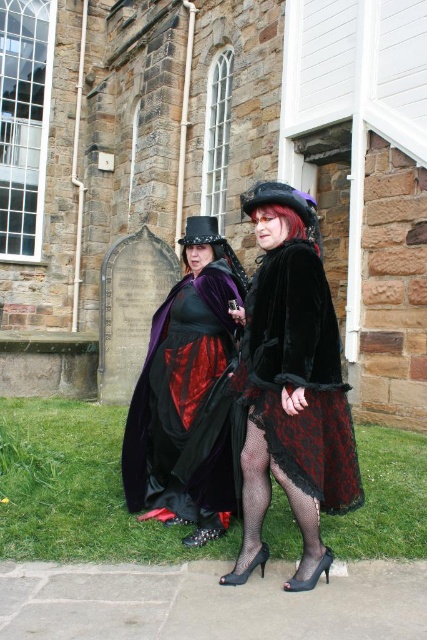
This screenshot has width=427, height=640. In order to click on velvet/black dress at center in this screenshot , I will do `click(283, 392)`.

Describe the element at coordinates (283, 392) in the screenshot. I see `velvet/black dress at center` at that location.

The height and width of the screenshot is (640, 427). Find the location of `velvet/black dress at center`. velvet/black dress at center is located at coordinates (283, 392).

Is velvet black coat at center further to camera compared to velvet/black lace dress at center?

Yes, it is behind velvet/black lace dress at center.

Between point (236, 456) and point (318, 456), which one is positioned in front?

Point (318, 456)

Is point (192, 481) farther from viewer compared to point (280, 276)?

Yes.

This screenshot has width=427, height=640. In order to click on velvet black coat at center in this screenshot , I will do `click(187, 392)`.

Is point (275, 253) in front of point (222, 340)?

Yes, point (275, 253) is closer to viewer.

Which is below, velvet/black dress at center or velvet black coat at center?

velvet/black dress at center is lower down.

What do you see at coordinates (283, 392) in the screenshot?
I see `velvet/black dress at center` at bounding box center [283, 392].

Find the location of a particular element. The image size is (427, 640). velvet/black dress at center is located at coordinates (283, 392).